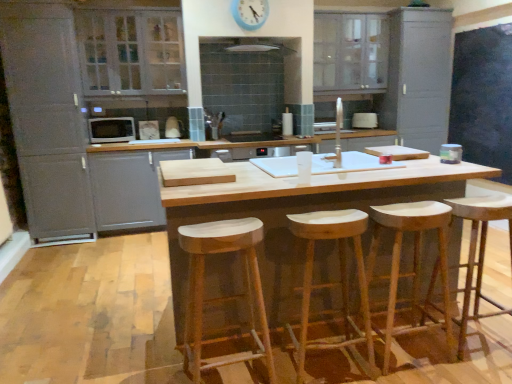
The image size is (512, 384). What are the coordinates of `vacant space situated on the left part of white wood stool at center, placed as the 3th stool when sorted from right to left` in the screenshot? It's located at (156, 365).